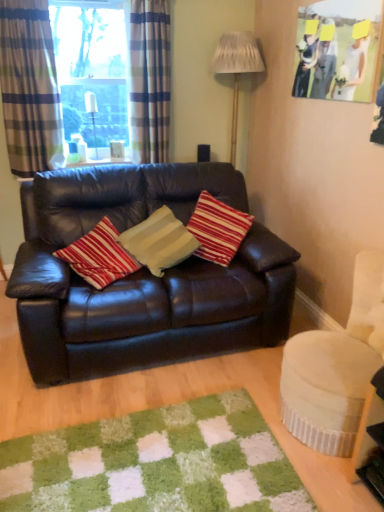
At what (x,y) coordinates should I click in order to perform the action: click on plaid fabric curtain at upper left, positioned as the first curtain in right-to-left order. Please return your answer as a coordinate pair (x, y). Looking at the image, I should click on (150, 80).

How much space does plaid fabric curtain at upper left, positioned as the first curtain in right-to-left order, occupy vertically?

3.71 feet.

What is the approximate width of clear glass window at upper left?

clear glass window at upper left is 7.66 inches in width.

Locate an element on the screen. striped fabric curtain at left, the 1th curtain viewed from the left is located at coordinates (29, 88).

The width and height of the screenshot is (384, 512). What do you see at coordinates (141, 276) in the screenshot?
I see `shiny brown leather couch at center` at bounding box center [141, 276].

At what (x,y) coordinates should I click in order to perform the action: click on plaid fabric curtain at upper left, positioned as the first curtain in right-to-left order. Please return your answer as a coordinate pair (x, y). Looking at the image, I should click on (150, 80).

Which object is further away from the camera taking this photo, striped fabric curtain at left, placed as the second curtain when sorted from right to left, or shiny brown leather couch at center?

Positioned behind is striped fabric curtain at left, placed as the second curtain when sorted from right to left.

From a real-world perspective, is striped fabric curtain at left, the 1th curtain viewed from the left, located beneath shiny brown leather couch at center?

No, from a real-world perspective, striped fabric curtain at left, the 1th curtain viewed from the left, is not under shiny brown leather couch at center.

Is point (29, 152) closer to camera compared to point (207, 276)?

No, it is behind (207, 276).

Would you say striped fabric curtain at left, placed as the second curtain when sorted from right to left, is inside or outside shiny brown leather couch at center?

striped fabric curtain at left, placed as the second curtain when sorted from right to left, lies outside shiny brown leather couch at center.

Which is less distant, (140,461) or (136,285)?

Clearly, point (140,461) is closer to the camera than point (136,285).

Which object is positioned more to the right, green shaggy mat at lower center or shiny brown leather couch at center?

From the viewer's perspective, green shaggy mat at lower center appears more on the right side.

Who is taller, green shaggy mat at lower center or shiny brown leather couch at center?

Standing taller between the two is shiny brown leather couch at center.

Between green shaggy mat at lower center and shiny brown leather couch at center, which one has smaller size?

green shaggy mat at lower center is smaller.

There is a shiny brown leather couch at center. What are the coordinates of `the 1st curtain above it (from a real-world perspective)` in the screenshot? It's located at (29, 88).

Is shiny brown leather couch at center at the left side of striped fabric curtain at left, placed as the second curtain when sorted from right to left?

Incorrect, shiny brown leather couch at center is not on the left side of striped fabric curtain at left, placed as the second curtain when sorted from right to left.

Does shiny brown leather couch at center turn towards striped fabric curtain at left, placed as the second curtain when sorted from right to left?

No, shiny brown leather couch at center does not turn towards striped fabric curtain at left, placed as the second curtain when sorted from right to left.

Is the position of shiny brown leather couch at center less distant than that of striped fabric curtain at left, placed as the second curtain when sorted from right to left?

Yes.

Where is `mat below the clear glass bottle at upper left, which is the second lamp from right to left (from a real-world perspective)`? mat below the clear glass bottle at upper left, which is the second lamp from right to left (from a real-world perspective) is located at coordinates (156, 463).

Is green shaggy mat at lower center oriented towards clear glass bottle at upper left, which is the second lamp from right to left?

No, green shaggy mat at lower center is not turned towards clear glass bottle at upper left, which is the second lamp from right to left.

Is green shaggy mat at lower center not near clear glass bottle at upper left, which is the second lamp from right to left?

Absolutely, green shaggy mat at lower center is distant from clear glass bottle at upper left, which is the second lamp from right to left.

Considering the sizes of objects green shaggy mat at lower center and clear glass bottle at upper left, which is the second lamp from right to left, in the image provided, who is shorter, green shaggy mat at lower center or clear glass bottle at upper left, which is the second lamp from right to left,?

Standing shorter between the two is green shaggy mat at lower center.

From the image's perspective, who appears lower, clear glass window at upper left or striped fabric curtain at left, placed as the second curtain when sorted from right to left?

From the image's view, striped fabric curtain at left, placed as the second curtain when sorted from right to left, is below.

Measure the distance from clear glass window at upper left to striped fabric curtain at left, placed as the second curtain when sorted from right to left.

clear glass window at upper left is 12.89 inches away from striped fabric curtain at left, placed as the second curtain when sorted from right to left.

Which object is closer to the camera, clear glass window at upper left or striped fabric curtain at left, the 1th curtain viewed from the left?

striped fabric curtain at left, the 1th curtain viewed from the left.

Is striped fabric curtain at left, placed as the second curtain when sorted from right to left, at the back of clear glass window at upper left?

No.

Is matte paper picture frame at upper right not within green shaggy mat at lower center?

Yes, matte paper picture frame at upper right is located beyond the bounds of green shaggy mat at lower center.

Between matte paper picture frame at upper right and green shaggy mat at lower center, which one appears on the right side from the viewer's perspective?

From the viewer's perspective, matte paper picture frame at upper right appears more on the right side.

Who is smaller, matte paper picture frame at upper right or green shaggy mat at lower center?

With smaller size is matte paper picture frame at upper right.

How distant is matte paper picture frame at upper right from green shaggy mat at lower center?

6.51 feet.

Is white textured lampshade at upper center, which is the second lamp in left-to-right order, not within matte paper picture frame at upper right?

Yes, white textured lampshade at upper center, which is the second lamp in left-to-right order, is outside of matte paper picture frame at upper right.

Can you see white textured lampshade at upper center, which is the second lamp in left-to-right order, touching matte paper picture frame at upper right?

No, white textured lampshade at upper center, which is the second lamp in left-to-right order, is not next to matte paper picture frame at upper right.

Is white textured lampshade at upper center, which is the second lamp in left-to-right order, thinner than matte paper picture frame at upper right?

No, white textured lampshade at upper center, which is the second lamp in left-to-right order, is not thinner than matte paper picture frame at upper right.

Measure the distance from white textured lampshade at upper center, which ranks as the 1th lamp in right-to-left order, to matte paper picture frame at upper right.

A distance of 30.46 inches exists between white textured lampshade at upper center, which ranks as the 1th lamp in right-to-left order, and matte paper picture frame at upper right.

The width and height of the screenshot is (384, 512). There is a shiny brown leather couch at center. In order to click on the 1st curtain above it (from a real-world perspective) in this screenshot , I will do `click(29, 88)`.

At what (x,y) coordinates should I click in order to perform the action: click on studio couch on the left side of green shaggy mat at lower center. Please return your answer as a coordinate pair (x, y). Image resolution: width=384 pixels, height=512 pixels. Looking at the image, I should click on [141, 276].

Based on their spatial positions, is plaid fabric curtain at upper left, positioned as the first curtain in right-to-left order, or green shaggy mat at lower center further from striped fabric curtain at left, the 1th curtain viewed from the left?

Among the two, green shaggy mat at lower center is located further to striped fabric curtain at left, the 1th curtain viewed from the left.

Which object lies nearer to the anchor point clear glass window at upper left, striped fabric curtain at left, placed as the second curtain when sorted from right to left, or velvet cream swivel chair at lower right?

striped fabric curtain at left, placed as the second curtain when sorted from right to left, is positioned closer to the anchor clear glass window at upper left.

Based on the photo, which object lies further to the anchor point plaid fabric curtain at upper left, acting as the second curtain starting from the left, shiny brown leather couch at center or white textured lampshade at upper center, which ranks as the 1th lamp in right-to-left order?

The object further to plaid fabric curtain at upper left, acting as the second curtain starting from the left, is shiny brown leather couch at center.

In the scene shown: Which object lies further to the anchor point white textured lampshade at upper center, which is the second lamp in left-to-right order, shiny brown leather couch at center or matte paper picture frame at upper right?

shiny brown leather couch at center.

When comparing their distances from white textured lampshade at upper center, which is the second lamp in left-to-right order, does green shaggy mat at lower center or clear glass window at upper left seem further?

green shaggy mat at lower center.

Looking at the image, which one is located further to plaid fabric curtain at upper left, acting as the second curtain starting from the left, velvet cream swivel chair at lower right or striped fabric curtain at left, placed as the second curtain when sorted from right to left?

velvet cream swivel chair at lower right.

Estimate the real-world distances between objects in this image. Which object is further from plaid fabric curtain at upper left, positioned as the first curtain in right-to-left order, clear glass window at upper left or clear glass bottle at upper left, which is the second lamp from right to left?

The object further to plaid fabric curtain at upper left, positioned as the first curtain in right-to-left order, is clear glass bottle at upper left, which is the second lamp from right to left.

Based on their spatial positions, is clear glass window at upper left or matte paper picture frame at upper right closer to striped fabric curtain at left, the 1th curtain viewed from the left?

The object closer to striped fabric curtain at left, the 1th curtain viewed from the left, is clear glass window at upper left.

Locate an element on the screen. window screen situated between clear glass bottle at upper left, which is the second lamp from right to left, and matte paper picture frame at upper right from left to right is located at coordinates [93, 71].

At what (x,y) coordinates should I click in order to perform the action: click on window screen situated between clear glass bottle at upper left, marked as the first lamp in a left-to-right arrangement, and white textured lampshade at upper center, which is the second lamp in left-to-right order, from left to right. Please return your answer as a coordinate pair (x, y). The height and width of the screenshot is (512, 384). Looking at the image, I should click on (93, 71).

Identify the location of picture frame between plaid fabric curtain at upper left, acting as the second curtain starting from the left, and green shaggy mat at lower center in the up-down direction. (338, 49).

The width and height of the screenshot is (384, 512). I want to click on swivel chair between white textured lampshade at upper center, which is the second lamp in left-to-right order, and green shaggy mat at lower center in the up-down direction, so click(336, 367).